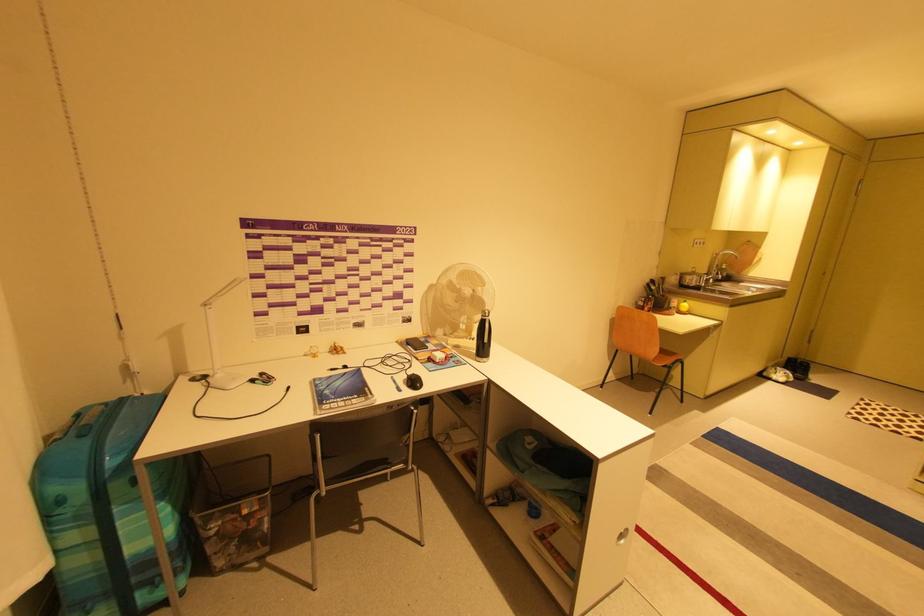
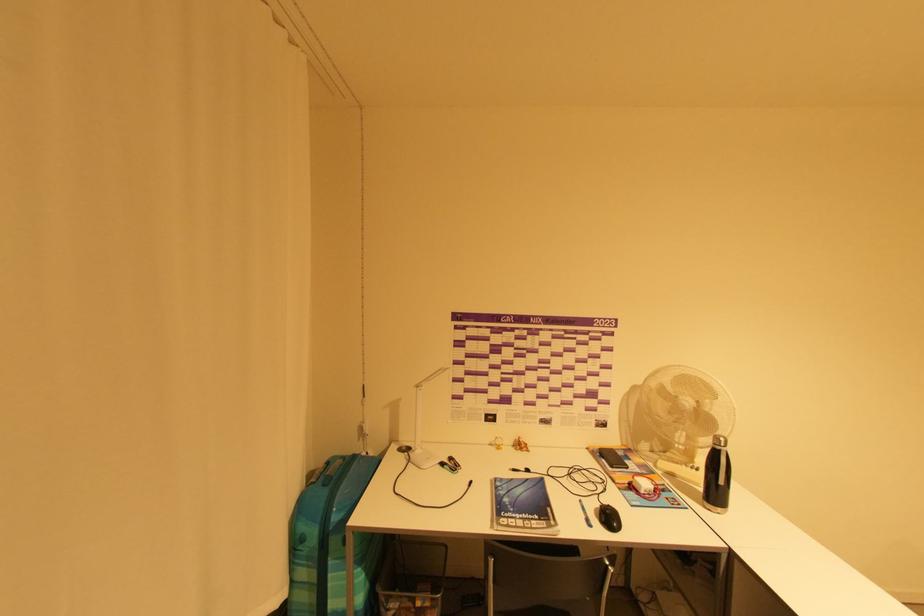
Where in the second image is the point corresponding to the point at 416,347 from the first image?

(609, 460)